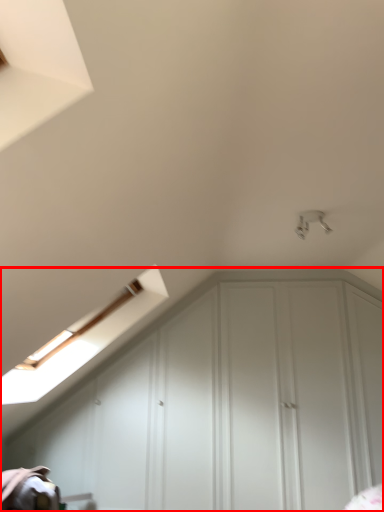
Question: From the image's perspective, what is the correct spatial positioning of dresser (annotated by the red box) in reference to light fixture?

Choices:
 (A) above
 (B) below

Answer: (B)